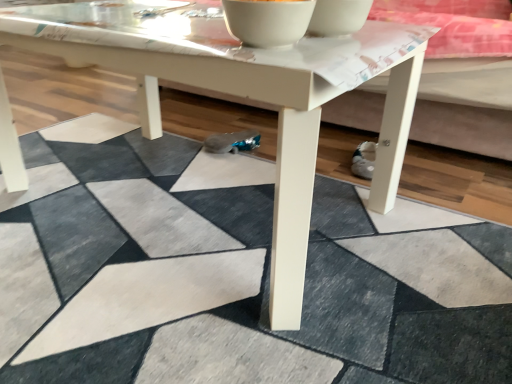
You are a GUI agent. You are given a task and a screenshot of the screen. Output one action in this format:
    pyautogui.click(x=<x>, y=<y>)
    Task: Click on the vacant region to the left of white glossy bowl at upper center, acting as the second bowl starting from the right
    Image resolution: width=512 pixels, height=384 pixels.
    Given the screenshot: What is the action you would take?
    pyautogui.click(x=174, y=31)